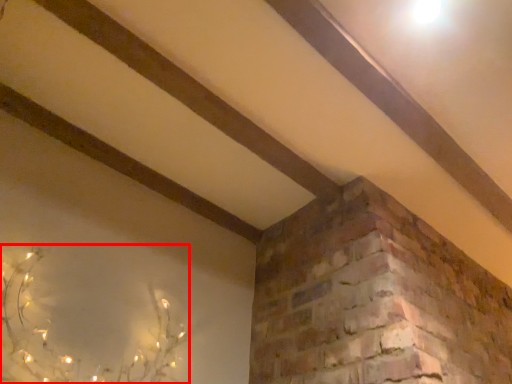
Question: Considering the relative positions of plant (annotated by the red box) and plank in the image provided, where is plant (annotated by the red box) located with respect to the staircase?

Choices:
 (A) left
 (B) right

Answer: (A)